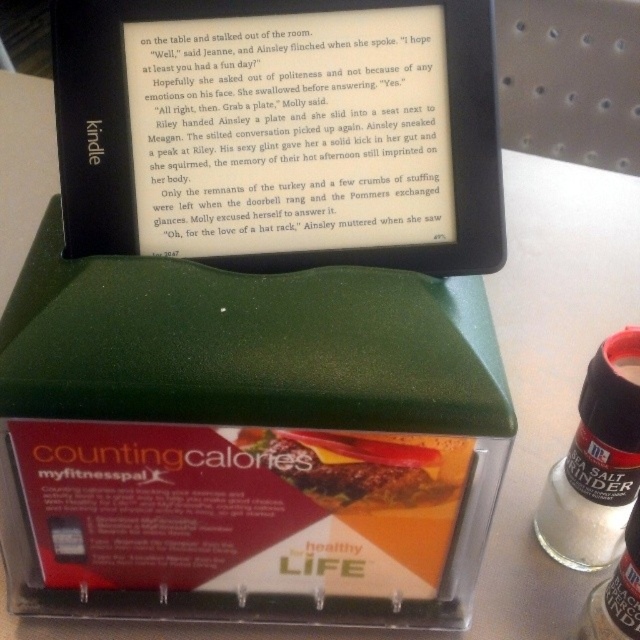
You are a nutritionist analyzing the image. The white plastic salt grinder at right and the golden crispy chicken at center are both visible. Which object is bigger in size?

The white plastic salt grinder at right is larger in size than the golden crispy chicken at center.

You are a food delivery robot that is 12 inches wide. You are positioned in front of the golden crispy chicken at center and need to move to the white plastic salt grinder at right. Can you fit through the space between them without moving either item?

The distance between the white plastic salt grinder at right and golden crispy chicken at center is 10.38 inches. Since the robot is 12 inches wide, it cannot fit through the space between them as the gap is narrower than the robot.

You are a chef preparing a dish and need to season the golden crispy chicken at center with salt. The white plastic salt grinder at right is on the counter. Can you reach the salt grinder without moving from your current position near the chicken?

The white plastic salt grinder at right is much taller than the golden crispy chicken at center, so it is likely within reach if the distance allows. However, the description does not provide information about the horizontal distance between them, so I cannot confirm reachability based on height alone.